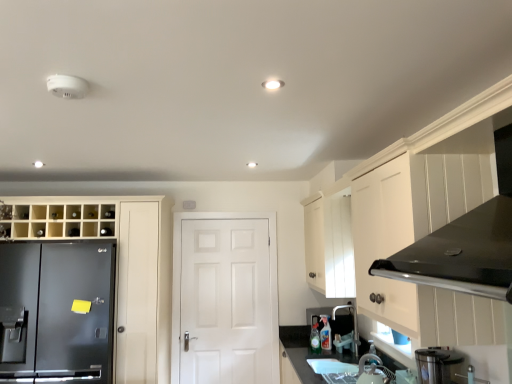
Where is `free point above white matte door at center (from a real-world perspective)`? Image resolution: width=512 pixels, height=384 pixels. free point above white matte door at center (from a real-world perspective) is located at coordinates (225, 224).